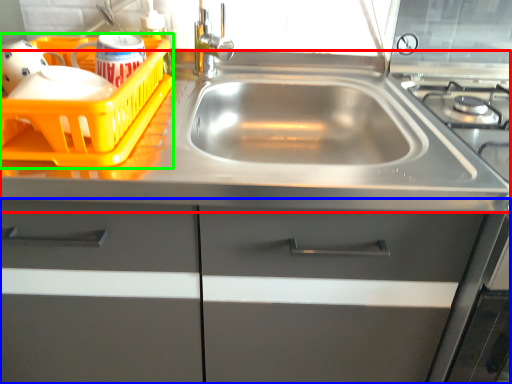
Question: Which object is the farthest from counter top (highlighted by a red box)? Choose among these: cabinetry (highlighted by a blue box) or basket (highlighted by a green box).

Choices:
 (A) cabinetry
 (B) basket

Answer: (A)